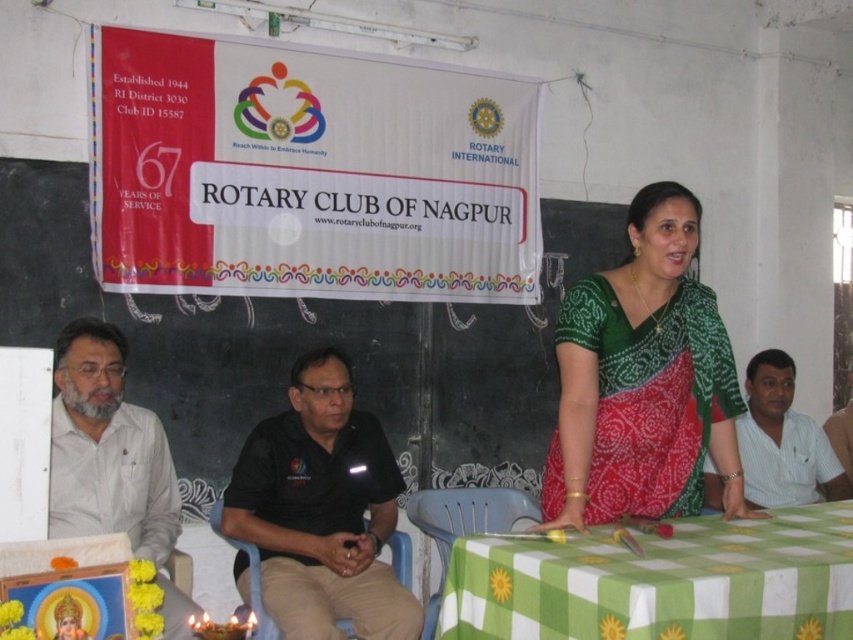
You are organizing a photo shoot for the Rotary Club of Nagpur and need to place both the green printed saree at center and the black smooth shirt at center on a table. Given their sizes, which item will require more space horizontally on the table?

The black smooth shirt at center requires more horizontal space because its width is greater than the green printed saree at center.